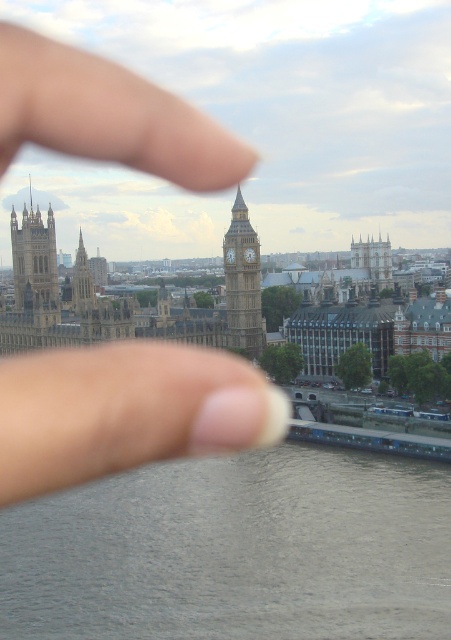
You are a photographer trying to capture the golden stone clock tower at center without any obstructions. Can you adjust your camera angle to avoid the white matte finger at center blocking the view?

The white matte finger at center is in front of the golden stone clock tower at center, so adjusting the camera angle to move the finger out of the frame would allow capturing the clock tower without obstruction.

You are a photographer planning to take a similar photo of the cityscape with a blurred background. You have a camera that can focus on objects up to 15 meters away. If you want to keep the gray smooth water at lower center in focus while blurring the background buildings, will your camera be able to achieve this?

The gray smooth water at lower center is 17.73 meters away from the camera. Since your camera can focus up to 15 meters, it cannot keep the gray smooth water at lower center in focus at that distance, so achieving the desired effect might not be possible with this camera.